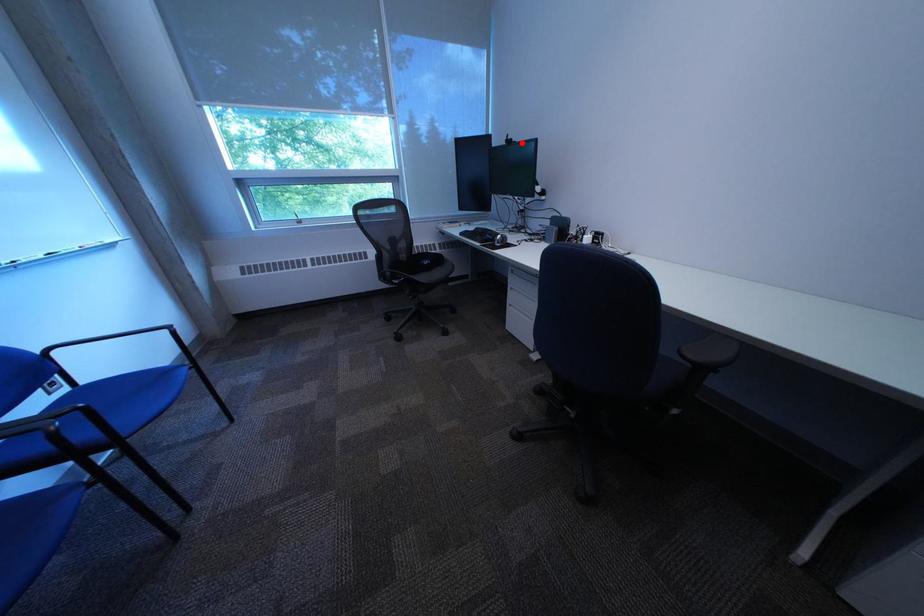
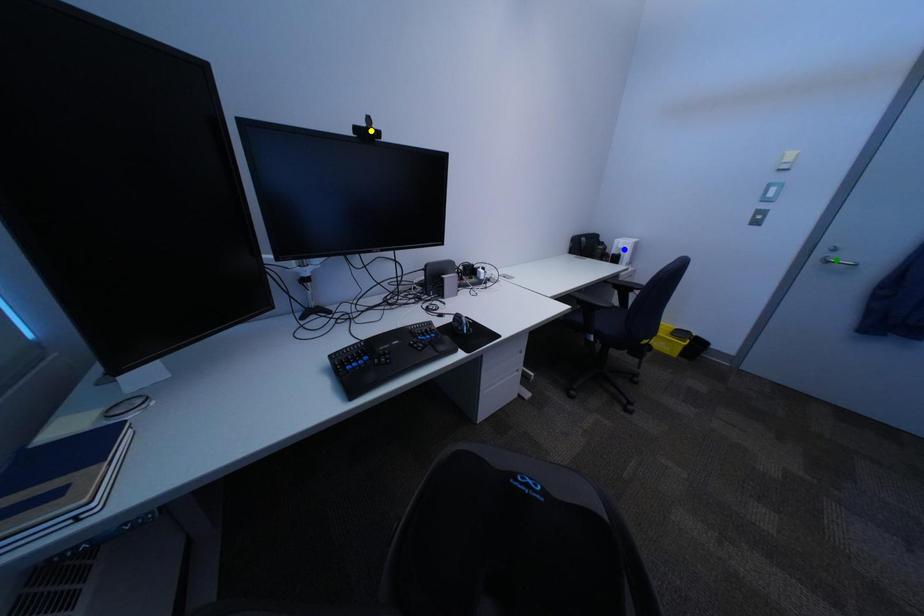
Question: I am providing you with two images of the same scene from different viewpoints. A red point is marked on the first image. You are given multiple points on the second image. Which point in image 2 represents the same 3d spot as the red point in image 1?

Choices:
 (A) blue point
 (B) green point
 (C) yellow point

Answer: (C)